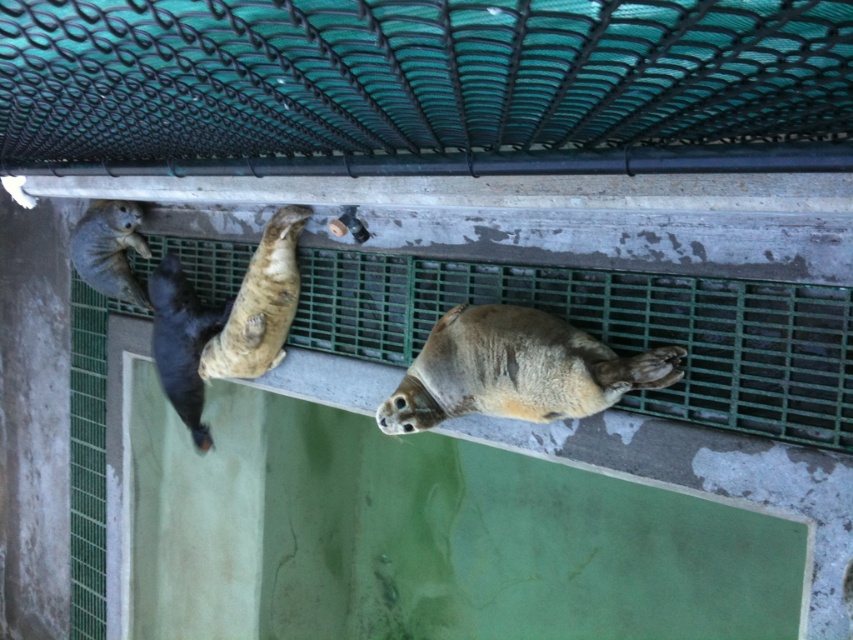
Question: Among these points, which one is farthest from the camera?

Choices:
 (A) (271, 260)
 (B) (527, 419)

Answer: (A)

Question: Among these points, which one is nearest to the camera?

Choices:
 (A) (254, 284)
 (B) (138, 289)
 (C) (527, 355)
 (D) (194, 365)

Answer: (C)

Question: Can you confirm if light brown fur seal at center is thinner than black fur seal at lower left?

Choices:
 (A) no
 (B) yes

Answer: (A)

Question: Considering the relative positions of brown fur seal at center and smooth gray seal at upper left in the image provided, where is brown fur seal at center located with respect to smooth gray seal at upper left?

Choices:
 (A) left
 (B) right

Answer: (B)

Question: Which object is positioned farthest from the black fur seal at lower left?

Choices:
 (A) brown fur seal at center
 (B) smooth gray seal at upper left
 (C) light brown fur seal at center

Answer: (C)

Question: Does brown fur seal at center have a greater width compared to smooth gray seal at upper left?

Choices:
 (A) yes
 (B) no

Answer: (A)